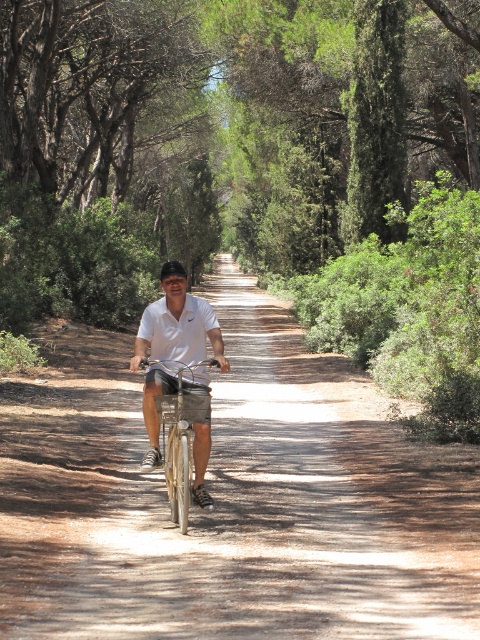
Between dirt path at center and white matte shirt at center, which one appears on the right side from the viewer's perspective?

white matte shirt at center is more to the right.

Does dirt path at center come behind white matte shirt at center?

No, it is not.

Is point (326, 556) in front of point (163, 300)?

Yes, it is in front of point (163, 300).

The width and height of the screenshot is (480, 640). I want to click on dirt path at center, so tap(229, 499).